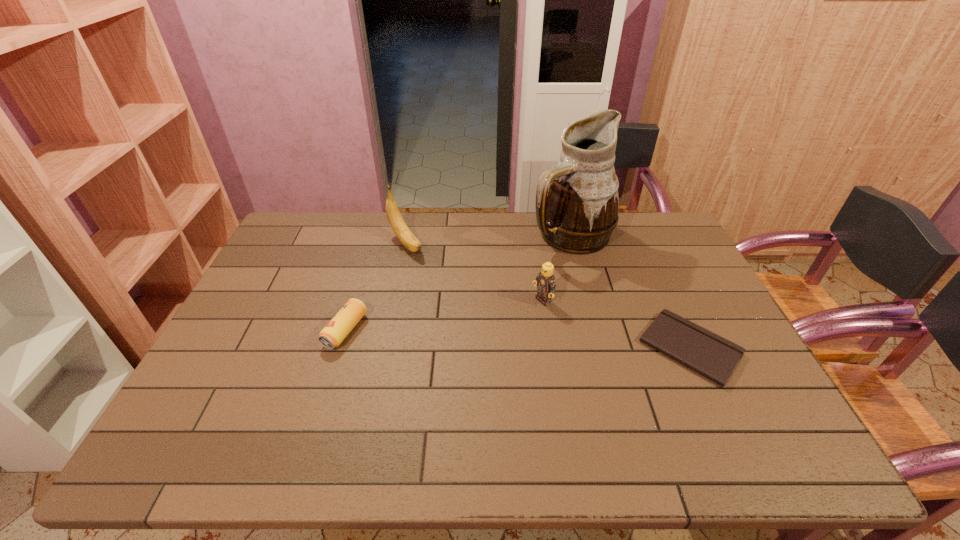
This screenshot has width=960, height=540. I want to click on vacant space located 0.290m at the start of the peel on the banana, so click(x=465, y=307).

The image size is (960, 540). In order to click on free point located in front of the third farthest object in this screenshot , I will do `click(430, 366)`.

Image resolution: width=960 pixels, height=540 pixels. In order to click on free region located in front of the third farthest object in this screenshot , I will do `click(503, 325)`.

The height and width of the screenshot is (540, 960). I want to click on vacant region located in front of the third farthest object, so click(x=460, y=349).

At what (x,y) coordinates should I click in order to perform the action: click on vacant space situated 0.210m from the spout of the tallest object. Please return your answer as a coordinate pair (x, y). The image size is (960, 540). Looking at the image, I should click on (562, 303).

The width and height of the screenshot is (960, 540). I want to click on vacant space located 0.330m from the spout of the tallest object, so click(558, 333).

The height and width of the screenshot is (540, 960). Identify the location of vacant region located from the spout of the tallest object. (563, 299).

This screenshot has width=960, height=540. Identify the location of banana at the far edge. (396, 221).

Identify the location of pitcher that is at the far edge. (577, 201).

Identify the location of object located in the near edge section of the desktop. (712, 356).